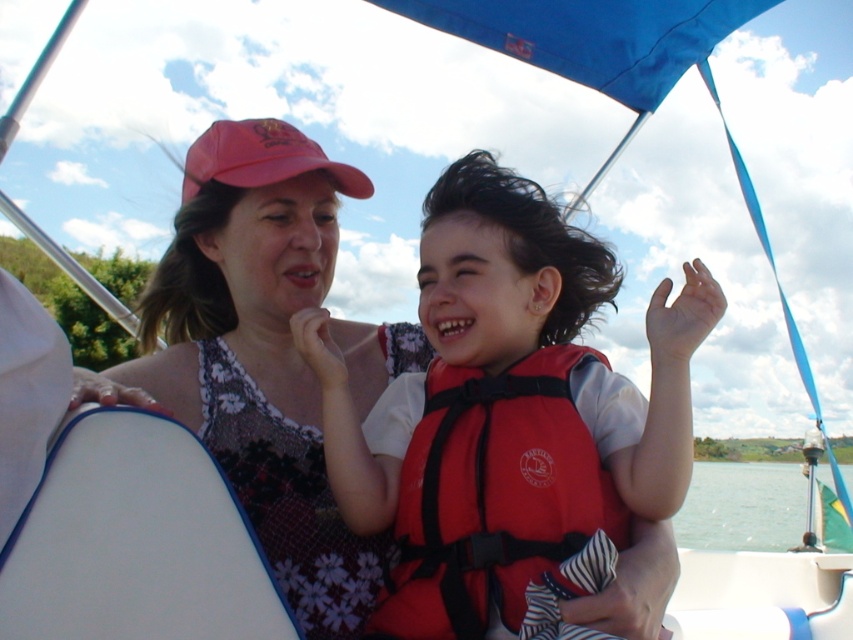
Is red matte life vest at center wider than clear water at lower right?

No.

Looking at this image, between red matte life vest at center and clear water at lower right, which one appears on the left side from the viewer's perspective?

Positioned to the left is red matte life vest at center.

Is point (392, 513) more distant than point (709, 534)?

That is False.

Find the location of `red matte life vest at center`. red matte life vest at center is located at coordinates point(506,410).

Find the location of a particular element. matte pink cap at upper center is located at coordinates coord(260,352).

Between matte pink cap at upper center and clear water at lower right, which one has less height?

With less height is clear water at lower right.

Which is behind, point (325, 285) or point (846, 486)?

The point (846, 486) is behind.

Identify the location of matte pink cap at upper center. (260, 352).

Between red matte life vest at center and red fabric life jacket at center, which one appears on the left side from the viewer's perspective?

From the viewer's perspective, red matte life vest at center appears more on the left side.

Can you confirm if red matte life vest at center is positioned above red fabric life jacket at center?

Yes.

Locate an element on the screen. red matte life vest at center is located at coordinates (506, 410).

This screenshot has width=853, height=640. What are the coordinates of `red matte life vest at center` in the screenshot? It's located at (506, 410).